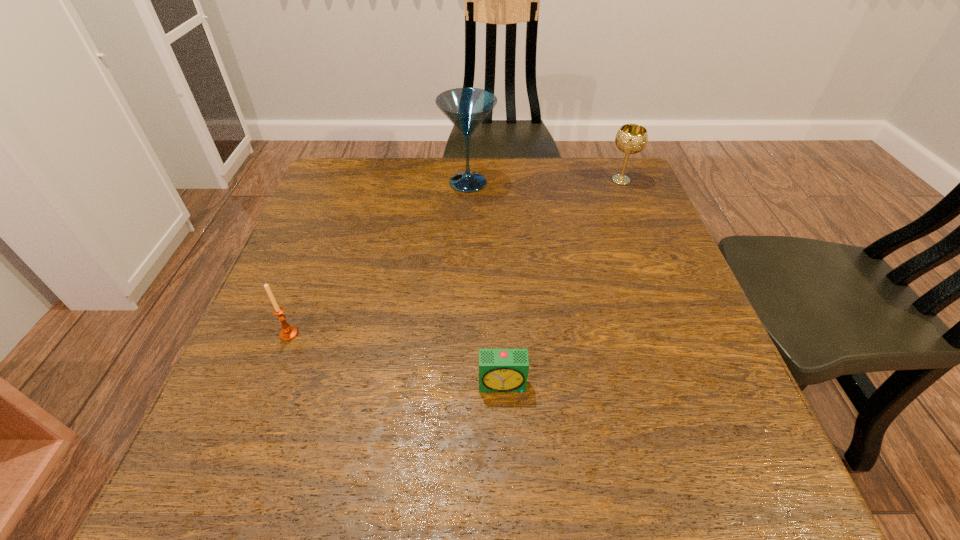
Find the location of a particular element. free space at the far right corner of the desktop is located at coordinates pos(588,174).

The height and width of the screenshot is (540, 960). I want to click on free space at the near right corner, so click(x=664, y=448).

The width and height of the screenshot is (960, 540). What are the coordinates of `vacant space that is in between the rightmost object and the martini` in the screenshot? It's located at (544, 181).

Find the location of a particular element. The height and width of the screenshot is (540, 960). vacant space that's between the shortest object and the leftmost object is located at coordinates (396, 359).

Identify the location of vacant area between the rightmost object and the nearest object. (562, 282).

The height and width of the screenshot is (540, 960). Find the location of `empty location between the martini and the shortest object`. empty location between the martini and the shortest object is located at coordinates (486, 284).

This screenshot has width=960, height=540. What are the coordinates of `free area in between the tallest object and the candle_holder` in the screenshot? It's located at (378, 258).

Locate an element on the screen. vacant space that is in between the shortest object and the tallest object is located at coordinates (486, 284).

The image size is (960, 540). I want to click on empty location between the tallest object and the chalice, so click(x=544, y=181).

The width and height of the screenshot is (960, 540). Identify the location of empty location between the martini and the chalice. coord(544,181).